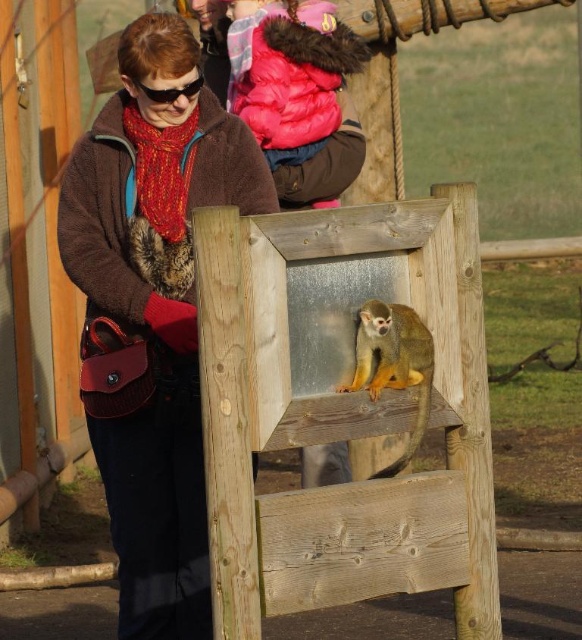
Is point (104, 332) behind point (374, 330)?

Yes, it is behind point (374, 330).

Between point (118, 326) and point (379, 371), which one is positioned behind?

The point (118, 326) is behind.

Is point (166, 593) positioned after point (361, 324)?

Yes, point (166, 593) is farther from viewer.

Where is `brown fuzzy jacket at upper left`? brown fuzzy jacket at upper left is located at coordinates (154, 308).

Who is lower down, brown fuzzy jacket at upper left or black plastic goggles at upper center?

brown fuzzy jacket at upper left

Can you confirm if brown fuzzy jacket at upper left is positioned above black plastic goggles at upper center?

No, brown fuzzy jacket at upper left is not above black plastic goggles at upper center.

Describe the element at coordinates (154, 308) in the screenshot. The image size is (582, 640). I see `brown fuzzy jacket at upper left` at that location.

This screenshot has width=582, height=640. I want to click on brown fuzzy jacket at upper left, so click(154, 308).

Does golden fur monkey at center lie in front of black plastic goggles at upper center?

Yes, it is.

From the picture: Is golden fur monkey at center below black plastic goggles at upper center?

Yes.

The width and height of the screenshot is (582, 640). What are the coordinates of `golden fur monkey at center` in the screenshot? It's located at (393, 364).

Locate an element on the screen. Image resolution: width=582 pixels, height=640 pixels. golden fur monkey at center is located at coordinates (393, 364).